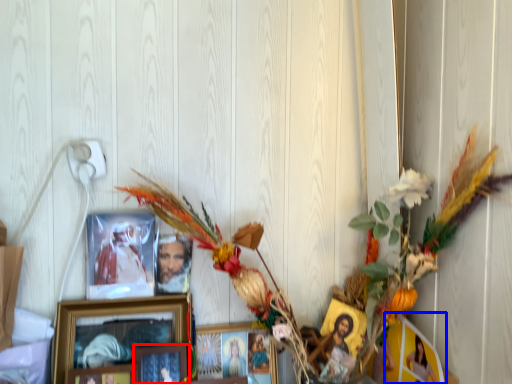
Question: Which point is closer to the camera, picture frame (highlighted by a red box) or picture frame (highlighted by a blue box)?

Choices:
 (A) picture frame
 (B) picture frame

Answer: (B)